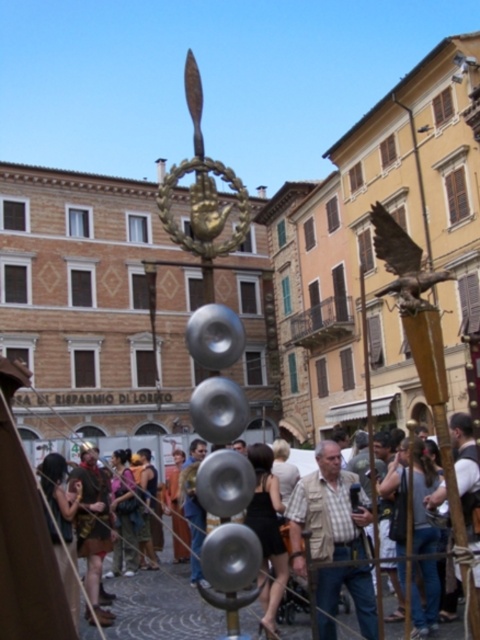
The image size is (480, 640). Describe the element at coordinates (162, 605) in the screenshot. I see `matte silver bell at center` at that location.

Is matte silver bell at center above bronze eagle at upper right?

No, matte silver bell at center is not above bronze eagle at upper right.

You are a GUI agent. You are given a task and a screenshot of the screen. Output one action in this format:
    pyautogui.click(x=<x>, y=<y>)
    Task: Click on the matte silver bell at center
    
    Given the screenshot: What is the action you would take?
    pyautogui.click(x=162, y=605)

Does light brown leather jacket at center have a greater width compared to gold metallic hand at center?

In fact, light brown leather jacket at center might be narrower than gold metallic hand at center.

The width and height of the screenshot is (480, 640). What do you see at coordinates (326, 513) in the screenshot?
I see `light brown leather jacket at center` at bounding box center [326, 513].

You are a GUI agent. You are given a task and a screenshot of the screen. Output one action in this format:
    pyautogui.click(x=<x>, y=<y>)
    Task: Click on the light brown leather jacket at center
    
    Given the screenshot: What is the action you would take?
    pyautogui.click(x=326, y=513)

Can you confirm if gold metallic hand at center is shorter than bronze eagle at upper right?

Incorrect, gold metallic hand at center's height does not fall short of bronze eagle at upper right's.

Does gold metallic hand at center have a smaller size compared to bronze eagle at upper right?

Incorrect, gold metallic hand at center is not smaller in size than bronze eagle at upper right.

What do you see at coordinates (203, 188) in the screenshot?
I see `gold metallic hand at center` at bounding box center [203, 188].

Find the location of a particular element. This screenshot has height=640, width=480. gold metallic hand at center is located at coordinates (203, 188).